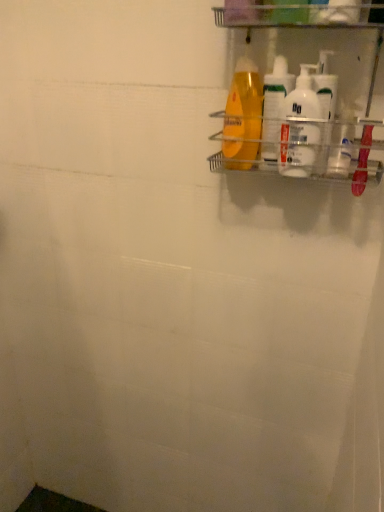
Question: Is clear plastic shelf at upper right thinner than translucent plastic shampoo bottle at upper right, which is the first cleaning product from left to right?

Choices:
 (A) no
 (B) yes

Answer: (A)

Question: Can you confirm if clear plastic shelf at upper right is smaller than translucent plastic shampoo bottle at upper right, which is the first cleaning product from left to right?

Choices:
 (A) no
 (B) yes

Answer: (A)

Question: From a real-world perspective, is clear plastic shelf at upper right over translucent plastic shampoo bottle at upper right, which is the first cleaning product from left to right?

Choices:
 (A) yes
 (B) no

Answer: (A)

Question: Is clear plastic shelf at upper right taller than translucent plastic shampoo bottle at upper right, marked as the fourth cleaning product in a right-to-left arrangement?

Choices:
 (A) yes
 (B) no

Answer: (A)

Question: Would you consider clear plastic shelf at upper right to be distant from translucent plastic shampoo bottle at upper right, marked as the fourth cleaning product in a right-to-left arrangement?

Choices:
 (A) yes
 (B) no

Answer: (B)

Question: In terms of size, does translucent plastic shampoo bottle at upper right, marked as the fourth cleaning product in a right-to-left arrangement, appear bigger or smaller than white glossy bottles at upper right, placed as the third cleaning product when sorted from left to right?

Choices:
 (A) big
 (B) small

Answer: (A)

Question: Looking at their shapes, would you say translucent plastic shampoo bottle at upper right, which is the first cleaning product from left to right, is wider or thinner than white glossy bottles at upper right, placed as the third cleaning product when sorted from left to right?

Choices:
 (A) thin
 (B) wide

Answer: (B)

Question: Does point (221, 148) appear closer or farther from the camera than point (311, 152)?

Choices:
 (A) farther
 (B) closer

Answer: (A)

Question: From their relative heights in the image, would you say translucent plastic shampoo bottle at upper right, which is the first cleaning product from left to right, is taller or shorter than white glossy bottles at upper right, placed as the third cleaning product when sorted from left to right?

Choices:
 (A) tall
 (B) short

Answer: (A)

Question: Visually, is translucent plastic bottle at upper right, the second cleaning product positioned from the left, positioned to the left or to the right of clear plastic bottle at upper right?

Choices:
 (A) right
 (B) left

Answer: (B)

Question: Is translucent plastic bottle at upper right, the second cleaning product positioned from the left, taller or shorter than clear plastic bottle at upper right?

Choices:
 (A) short
 (B) tall

Answer: (B)

Question: In the image, is translucent plastic bottle at upper right, the second cleaning product positioned from the left, positioned in front of or behind clear plastic bottle at upper right?

Choices:
 (A) behind
 (B) front

Answer: (A)

Question: Based on their sizes in the image, would you say translucent plastic bottle at upper right, which is the third cleaning product from right to left, is bigger or smaller than clear plastic bottle at upper right?

Choices:
 (A) small
 (B) big

Answer: (B)

Question: Does point (324, 51) appear closer or farther from the camera than point (342, 165)?

Choices:
 (A) closer
 (B) farther

Answer: (A)

Question: From a real-world perspective, is white plastic bottles at upper right, which is the 4th cleaning product from left to right, physically located above or below clear plastic bottle at upper right?

Choices:
 (A) below
 (B) above

Answer: (B)